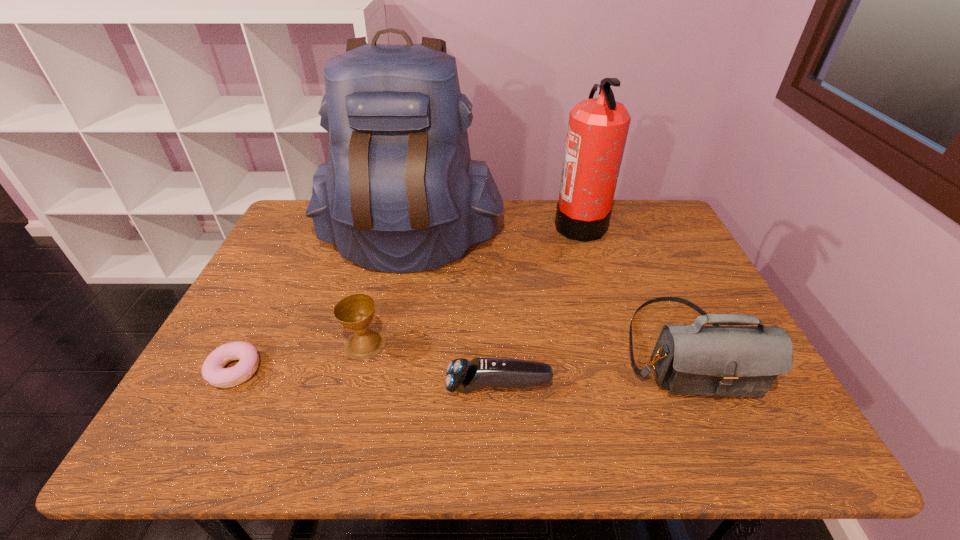
Locate an element on the screen. The image size is (960, 540). the tallest object is located at coordinates (399, 193).

Where is `fire extinguisher`? This screenshot has height=540, width=960. fire extinguisher is located at coordinates [597, 131].

Where is `shoulder bag`? shoulder bag is located at coordinates (695, 359).

Image resolution: width=960 pixels, height=540 pixels. I want to click on chalice, so click(x=355, y=312).

The height and width of the screenshot is (540, 960). In order to click on the fifth tallest object in this screenshot , I will do `click(467, 376)`.

Locate an element on the screen. Image resolution: width=960 pixels, height=540 pixels. doughnut is located at coordinates (213, 371).

At what (x,y) coordinates should I click in order to perform the action: click on free space located 0.170m at the front pocket of the tallest object. Please return your answer as a coordinate pair (x, y). The width and height of the screenshot is (960, 540). Looking at the image, I should click on (391, 326).

I want to click on blank space located 0.360m on the front side of the fire extinguisher, so click(x=444, y=224).

Identify the location of free space located on the front side of the fire extinguisher. (447, 224).

You are a GUI agent. You are given a task and a screenshot of the screen. Output one action in this format:
    pyautogui.click(x=<x>, y=<y>)
    Task: Click on the free location located 0.300m on the front side of the fire extinguisher
    This screenshot has width=960, height=540.
    Given the screenshot: What is the action you would take?
    pyautogui.click(x=463, y=224)